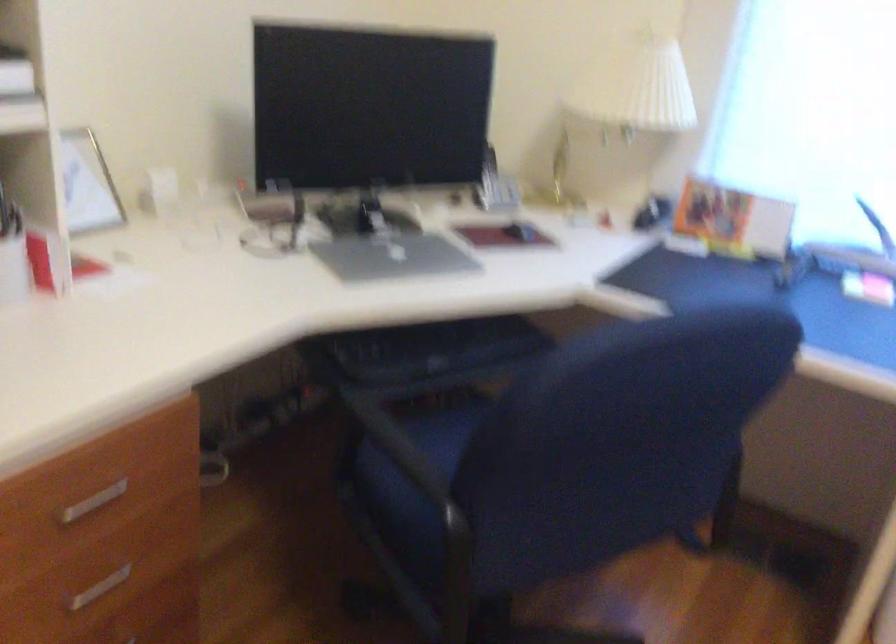
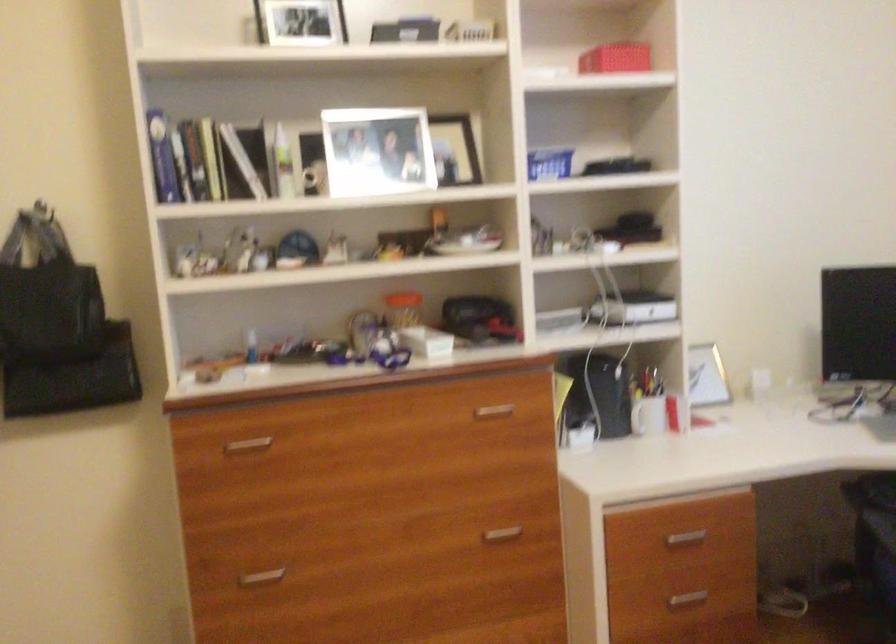
In the second image, find the point that corresponds to (x=82, y=498) in the first image.

(685, 538)